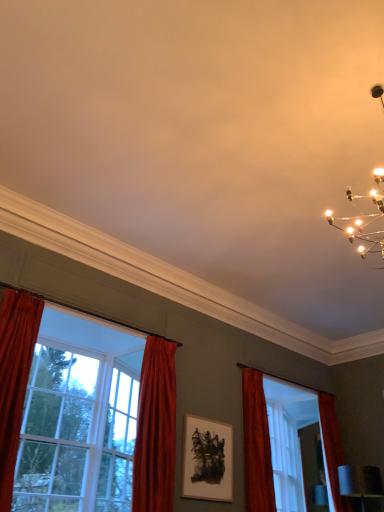
Question: Is wooden picture frame at center positioned before velvet red curtain at center, the first curtain positioned from the left?

Choices:
 (A) no
 (B) yes

Answer: (A)

Question: Is wooden picture frame at center with velvet red curtain at center, acting as the 2th curtain starting from the right?

Choices:
 (A) yes
 (B) no

Answer: (B)

Question: Does wooden picture frame at center have a greater height compared to velvet red curtain at center, the first curtain positioned from the left?

Choices:
 (A) no
 (B) yes

Answer: (A)

Question: Is velvet red curtain at center, the first curtain positioned from the left, located within wooden picture frame at center?

Choices:
 (A) yes
 (B) no

Answer: (B)

Question: From the image's perspective, is wooden picture frame at center on velvet red curtain at center, the first curtain positioned from the left?

Choices:
 (A) no
 (B) yes

Answer: (A)

Question: Is velvet red curtain at center, acting as the 2th curtain starting from the right, taller or shorter than clear glass window at left, positioned as the 1th window in left-to-right order?

Choices:
 (A) short
 (B) tall

Answer: (A)

Question: In the image, is velvet red curtain at center, acting as the 2th curtain starting from the right, positioned in front of or behind clear glass window at left, the third window viewed from the right?

Choices:
 (A) behind
 (B) front

Answer: (A)

Question: Looking at the image, does velvet red curtain at center, the first curtain positioned from the left, seem bigger or smaller compared to clear glass window at left, positioned as the 1th window in left-to-right order?

Choices:
 (A) big
 (B) small

Answer: (B)

Question: From a real-world perspective, is velvet red curtain at center, acting as the 2th curtain starting from the right, physically located above or below clear glass window at left, the third window viewed from the right?

Choices:
 (A) above
 (B) below

Answer: (A)

Question: Relative to clear glass window at left, which is the 2th window in right-to-left order, is velvet red curtain at right, the 1th curtain viewed from the right, in front or behind?

Choices:
 (A) behind
 (B) front

Answer: (A)

Question: From a real-world perspective, relative to clear glass window at left, the 2th window positioned from the left, is velvet red curtain at right, the 2th curtain in the left-to-right sequence, vertically above or below?

Choices:
 (A) below
 (B) above

Answer: (B)

Question: Considering the positions of velvet red curtain at right, the 2th curtain in the left-to-right sequence, and clear glass window at left, the 2th window positioned from the left, in the image, is velvet red curtain at right, the 2th curtain in the left-to-right sequence, wider or thinner than clear glass window at left, the 2th window positioned from the left,?

Choices:
 (A) wide
 (B) thin

Answer: (B)

Question: Looking at the image, does velvet red curtain at right, the 1th curtain viewed from the right, seem bigger or smaller compared to clear glass window at left, which is the 2th window in right-to-left order?

Choices:
 (A) small
 (B) big

Answer: (A)

Question: From the image's perspective, relative to velvet red curtain at right, the 1th curtain viewed from the right, is wooden picture frame at center above or below?

Choices:
 (A) above
 (B) below

Answer: (B)

Question: In terms of width, does wooden picture frame at center look wider or thinner when compared to velvet red curtain at right, the 1th curtain viewed from the right?

Choices:
 (A) thin
 (B) wide

Answer: (A)